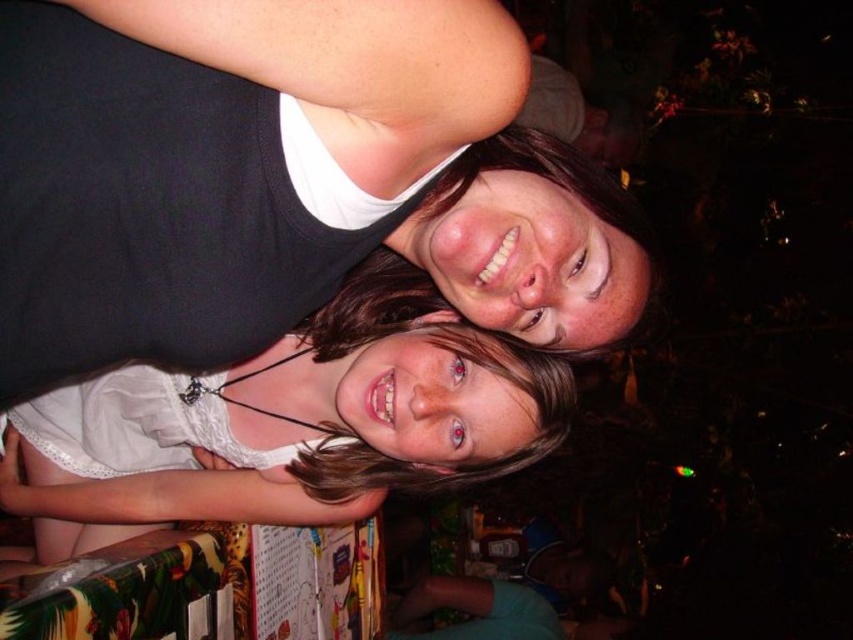
You are a photographer trying to capture a clear shot of both the matte black tank top at upper center and the white lace dress at center. Considering the camera has a depth of field of 12 inches, will both objects be in focus?

The matte black tank top at upper center is 13.13 inches from the white lace dress at center. Since the distance between them exceeds the camera depth of field of 12 inches, the two objects will not be in focus simultaneously.

You are a photographer trying to adjust the lighting for a portrait. You notice the matte black tank top at upper center and the white lace dress at center. Which object should you focus on to ensure the subject in front is properly lit?

The matte black tank top at upper center is in front of the white lace dress at center, so focusing on the matte black tank top at upper center will ensure the subject in front is properly lit.

Consider the image. You are a photographer trying to adjust the lighting for a photo shoot. You notice the matte black tank top at upper center and the white lace dress at center. Which clothing item might require more light to ensure it appears brighter in the final image?

The matte black tank top at upper center is shorter than the white lace dress at center, so the white lace dress at center might require more light to ensure it appears brighter in the final image because lighter colors typically need more illumination to avoid appearing washed out.